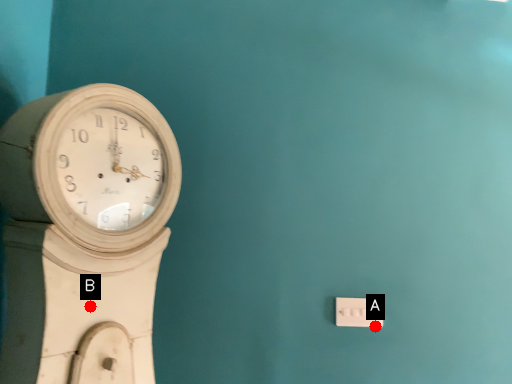
Question: Two points are circled on the image, labeled by A and B beside each circle. Which point is closer to the camera?

Choices:
 (A) A is closer
 (B) B is closer

Answer: (B)